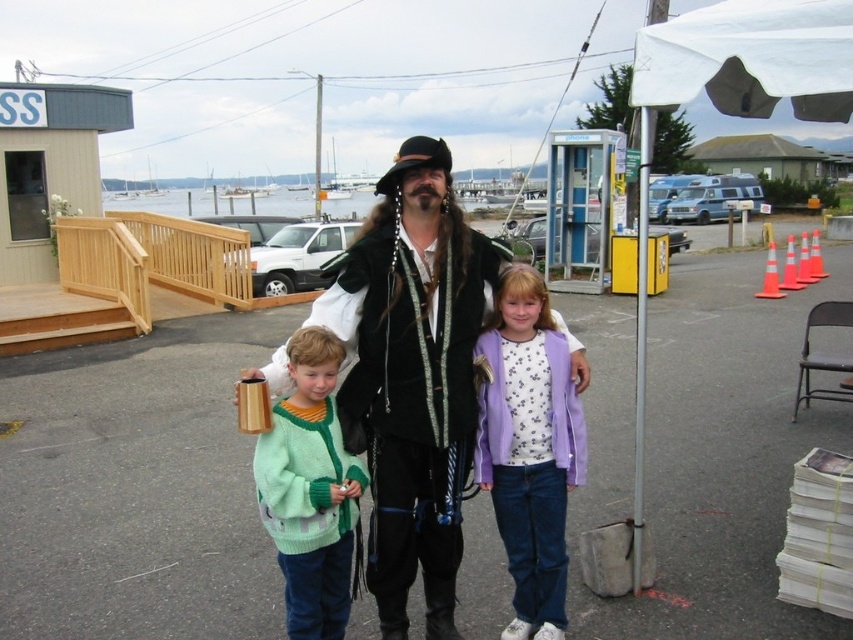
You are a photographer trying to capture a group photo of the purple cotton jacket at center and the green knitted sweater at center. If your camera has a minimum focus distance of 24 inches, will you need to step back to ensure both are in frame?

The distance between the purple cotton jacket at center and the green knitted sweater at center is 25.98 inches. Since the camera requires a minimum focus distance of 24 inches, you will need to step back slightly to ensure both are in frame.

You are standing at the parking lot and want to walk from point A to point B. Point A is at coordinates point (445,445) and point B is at coordinates point (520,349). Which direction should you walk to reach point B from point A?

To reach point B from point A, you should walk towards the northwest direction because point (445,445) is in front of point (520,349), indicating that point B is located behind point A in the northwest direction.